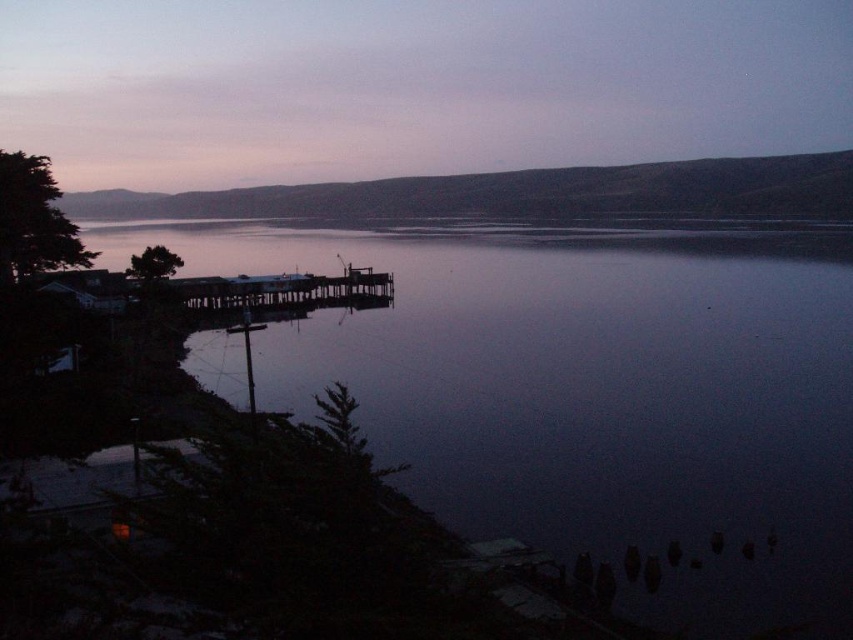
Can you confirm if purple matte sky at upper center is positioned below wooden pier at center?

Incorrect, purple matte sky at upper center is not positioned below wooden pier at center.

In the scene shown: Is purple matte sky at upper center bigger than wooden pier at center?

Yes.

Is point (474, 99) more distant than point (244, 282)?

Yes, it is behind point (244, 282).

In order to click on purple matte sky at upper center in this screenshot , I will do `click(412, 84)`.

Does dark reflective water at center come in front of purple matte sky at upper center?

Yes, dark reflective water at center is in front of purple matte sky at upper center.

Does point (798, 486) come farther from viewer compared to point (653, 141)?

No, it is not.

What are the coordinates of `dark reflective water at center` in the screenshot? It's located at (590, 394).

Between dark reflective water at center and wooden pier at center, which one is positioned lower?

wooden pier at center

Can you confirm if dark reflective water at center is taller than wooden pier at center?

Correct, dark reflective water at center is much taller as wooden pier at center.

Describe the element at coordinates (590, 394) in the screenshot. I see `dark reflective water at center` at that location.

Find the location of `dark reflective water at center`. dark reflective water at center is located at coordinates (590, 394).